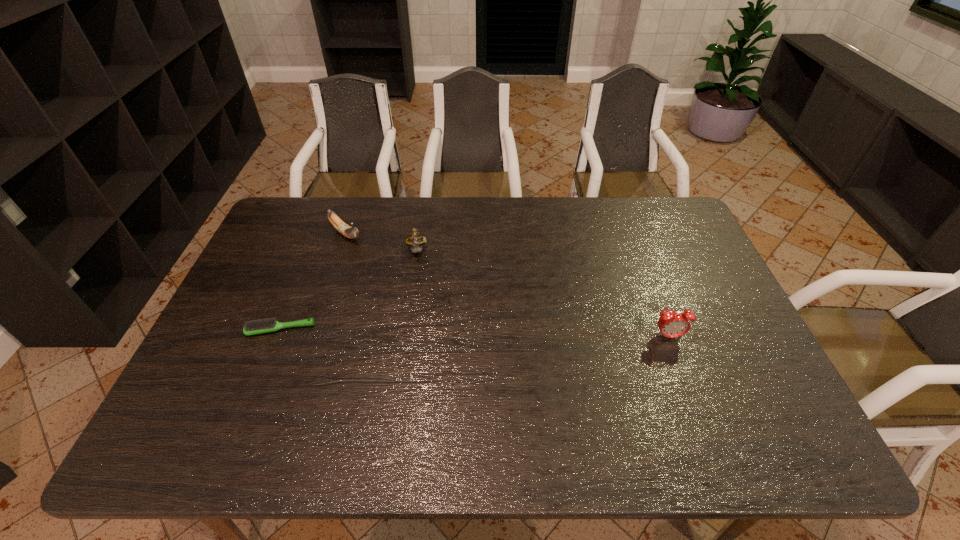
You are a GUI agent. You are given a task and a screenshot of the screen. Output one action in this format:
    pyautogui.click(x=<x>, y=<y>)
    Task: Click on the free location located 0.360m on the peel of the third tallest object
    The width and height of the screenshot is (960, 540).
    Given the screenshot: What is the action you would take?
    pyautogui.click(x=423, y=302)

Where is `vacant point located 0.350m on the peel of the third tallest object`? vacant point located 0.350m on the peel of the third tallest object is located at coordinates (421, 301).

Find the location of a particular element. This screenshot has height=540, width=960. object that is at the far edge is located at coordinates (350, 232).

Locate an element on the screen. The height and width of the screenshot is (540, 960). object at the left edge is located at coordinates (260, 326).

At what (x,y) coordinates should I click in order to perform the action: click on object at the right edge. Please return your answer as a coordinate pair (x, y). Looking at the image, I should click on (671, 324).

The image size is (960, 540). Find the location of `free region at the far edge`. free region at the far edge is located at coordinates (607, 238).

Image resolution: width=960 pixels, height=540 pixels. In order to click on free space at the near edge of the desktop in this screenshot , I will do `click(691, 383)`.

The width and height of the screenshot is (960, 540). Find the location of `vacant space at the left edge of the desktop`. vacant space at the left edge of the desktop is located at coordinates (237, 364).

Find the location of a particular element. This screenshot has height=540, width=960. vacant area at the right edge is located at coordinates (670, 268).

Locate an element on the screen. vacant position at the near left corner of the desktop is located at coordinates (225, 382).